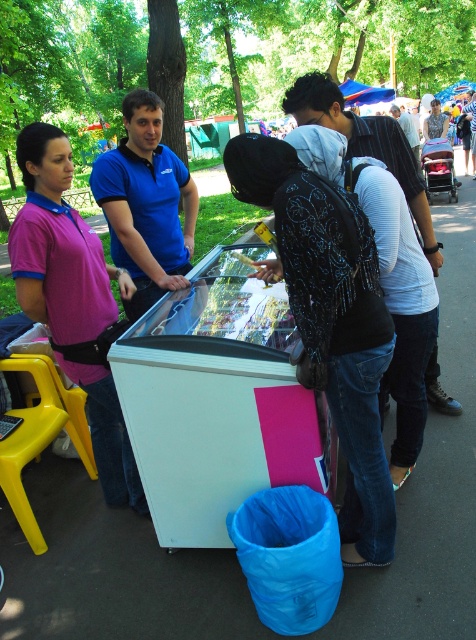
You are a customer at the ice cream stall and want to know which item is wider between the blue cotton polo shirt at center and the white textured backpack at center. Could you tell me which one is wider?

The blue cotton polo shirt at center is wider than the white textured backpack at center according to the description.

You are standing at the food stall and want to reach the point marked as point (156, 198). Which direction should you move relative to point (362, 140)?

To reach point (156, 198) from point (362, 140), you should move downward and to the right since point (156, 198) is located below and to the right of point (362, 140).